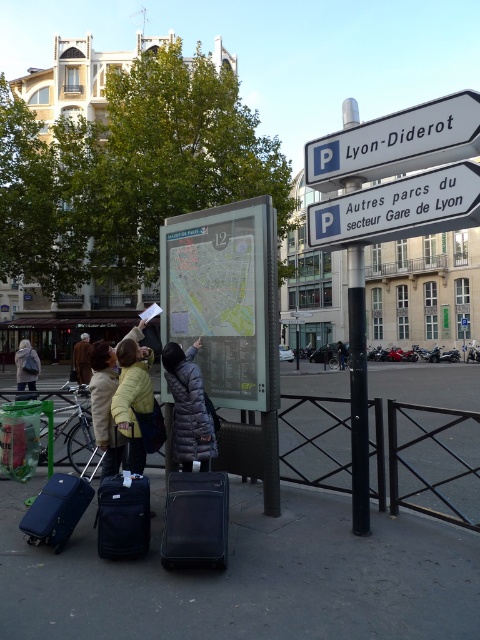
Question: Is blue plastic parking sign at upper right to the right of dark gray jacket at center from the viewer's perspective?

Choices:
 (A) yes
 (B) no

Answer: (B)

Question: Which is nearer to the black fabric suitcase at lower left?

Choices:
 (A) black metal pole at center
 (B) light gray down jacket at center
 (C) dark blue fabric suitcase at lower left
 (D) yellow down jacket at center

Answer: (B)

Question: Which point is farther to the camera?

Choices:
 (A) (68, 492)
 (B) (340, 348)
 (C) (86, 368)
 (D) (200, 474)

Answer: (B)

Question: Is matte blue suitcase at lower left to the right of light gray jacket at center from the viewer's perspective?

Choices:
 (A) yes
 (B) no

Answer: (A)

Question: Which object is farther from the camera taking this photo?

Choices:
 (A) white plastic street sign at upper right
 (B) blue plastic parking sign at upper right
 (C) light gray jacket at center

Answer: (C)

Question: Can you confirm if dark blue fabric suitcase at lower left is positioned below yellow down jacket at center?

Choices:
 (A) yes
 (B) no

Answer: (A)